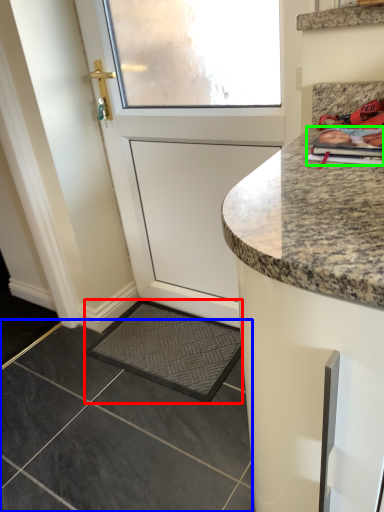
Question: Based on their relative distances, which object is nearer to slate (highlighted by a red box)? Choose from granite (highlighted by a blue box) and magazine (highlighted by a green box).

Choices:
 (A) granite
 (B) magazine

Answer: (A)